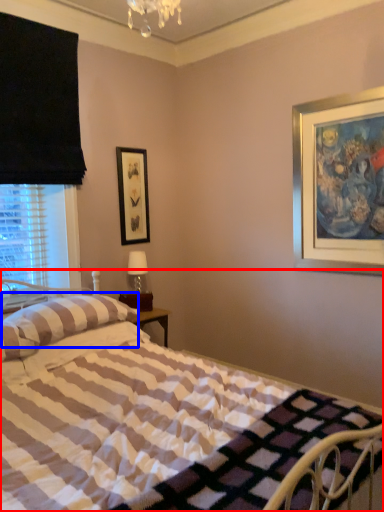
Question: Which point is further to the camera, bed (highlighted by a red box) or pillow (highlighted by a blue box)?

Choices:
 (A) bed
 (B) pillow

Answer: (B)